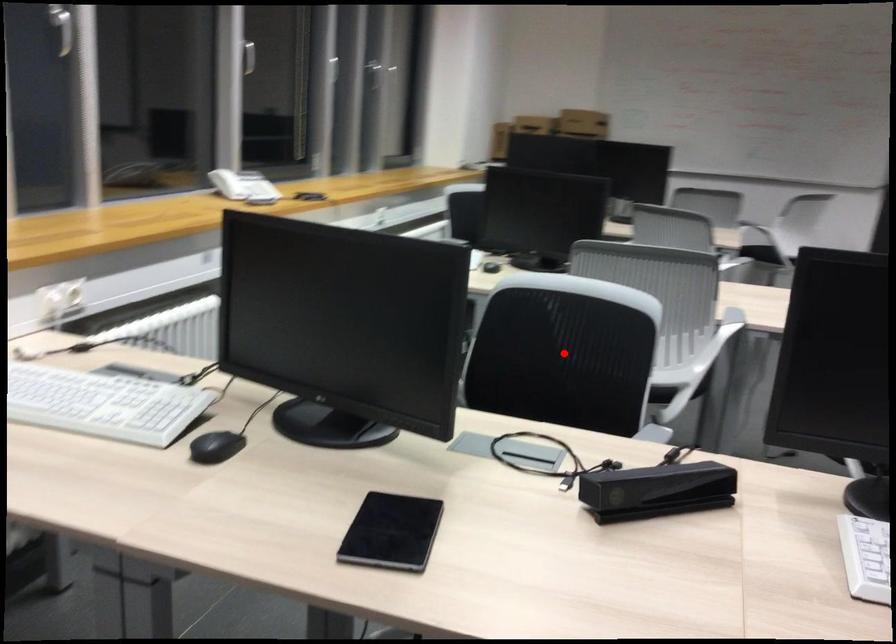
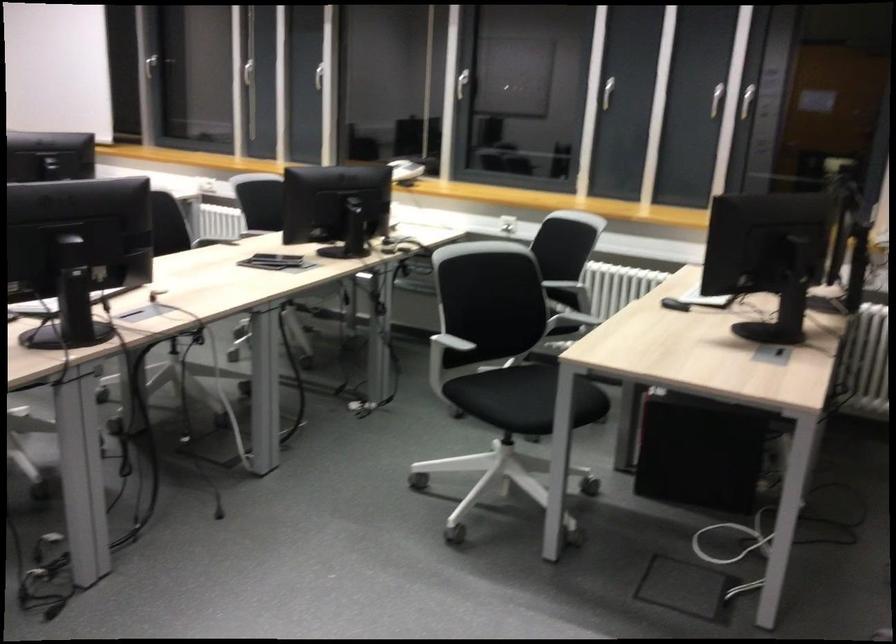
Question: I am providing you with two images of the same scene from different viewpoints. A red point is marked on the first image. Is the red point's position out of view in image 2?

Choices:
 (A) Yes
 (B) No

Answer: (A)